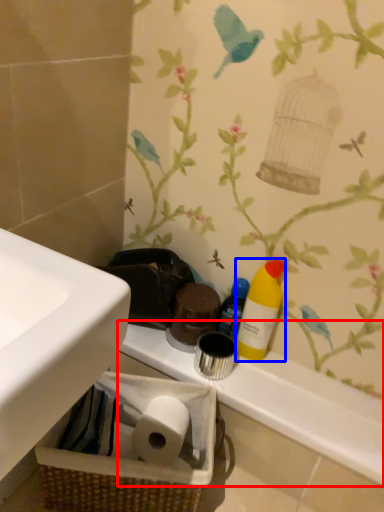
Question: Which object appears farthest to the camera in this image, counter top (highlighted by a red box) or cleaning product (highlighted by a blue box)?

Choices:
 (A) counter top
 (B) cleaning product

Answer: (B)